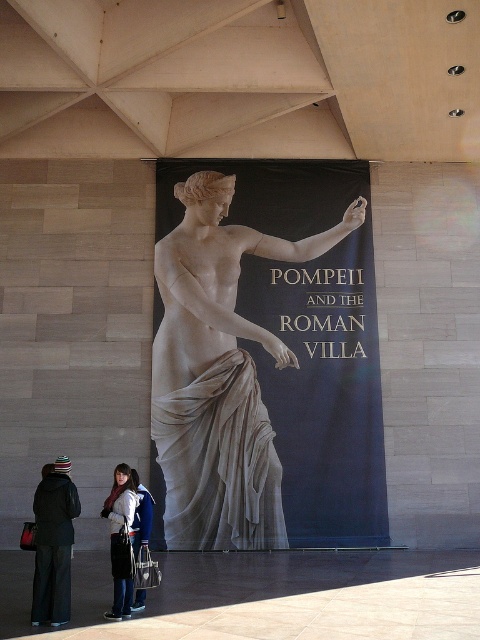
Between point (180, 536) and point (68, 572), which one is positioned behind?

The point (180, 536) is more distant.

Is point (247, 529) in front of point (41, 538)?

No, it is behind (41, 538).

Find the location of a particular element. white marble statue at center is located at coordinates (218, 374).

Can you confirm if black woolen jacket at lower left is positioned below white knit hat at lower left?

Actually, black woolen jacket at lower left is above white knit hat at lower left.

Who is more distant from viewer, (48, 586) or (113, 554)?

The point (113, 554) is more distant.

Find the location of `black woolen jacket at lower left`. black woolen jacket at lower left is located at coordinates (54, 544).

Can you confirm if white marble statue at center is positioned below white knit hat at lower left?

Indeed, white marble statue at center is positioned under white knit hat at lower left.

Does white marble statue at center appear over white knit hat at lower left?

No.

Measure the distance between white marble statue at center and camera.

They are 12.91 meters apart.

The width and height of the screenshot is (480, 640). Identify the location of white marble statue at center. (218, 374).